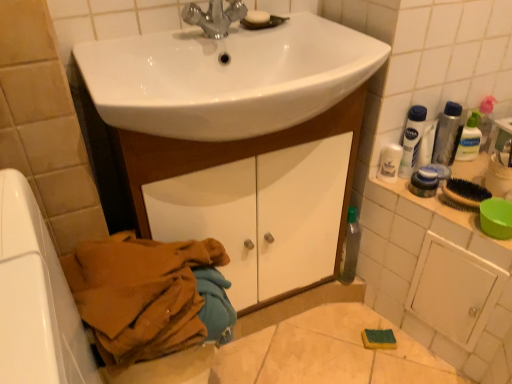
Question: Does white glossy sink at center have a greater height compared to white plastic bottle at upper right?

Choices:
 (A) yes
 (B) no

Answer: (B)

Question: Is white glossy sink at center further to the viewer compared to white plastic bottle at upper right?

Choices:
 (A) no
 (B) yes

Answer: (A)

Question: Considering the relative sizes of white glossy sink at center and white plastic bottle at upper right in the image provided, is white glossy sink at center thinner than white plastic bottle at upper right?

Choices:
 (A) yes
 (B) no

Answer: (B)

Question: Is white glossy sink at center aimed at white plastic bottle at upper right?

Choices:
 (A) no
 (B) yes

Answer: (A)

Question: Does white glossy sink at center have a lesser height compared to white plastic bottle at upper right?

Choices:
 (A) no
 (B) yes

Answer: (B)

Question: From a real-world perspective, does white glossy sink at center sit lower than white plastic bottle at upper right?

Choices:
 (A) no
 (B) yes

Answer: (A)

Question: Is silver metallic faucet at upper center located within clear plastic bottle at upper right, acting as the second toiletry starting from the bottom?

Choices:
 (A) yes
 (B) no

Answer: (B)

Question: Considering the relative sizes of clear plastic bottle at upper right, acting as the second toiletry starting from the bottom, and silver metallic faucet at upper center in the image provided, is clear plastic bottle at upper right, acting as the second toiletry starting from the bottom, thinner than silver metallic faucet at upper center?

Choices:
 (A) yes
 (B) no

Answer: (A)

Question: From a real-world perspective, is clear plastic bottle at upper right, the 1th toiletry when ordered from right to left, positioned over silver metallic faucet at upper center based on gravity?

Choices:
 (A) yes
 (B) no

Answer: (B)

Question: Considering the relative sizes of clear plastic bottle at upper right, positioned as the first toiletry in top-to-bottom order, and silver metallic faucet at upper center in the image provided, is clear plastic bottle at upper right, positioned as the first toiletry in top-to-bottom order, shorter than silver metallic faucet at upper center?

Choices:
 (A) yes
 (B) no

Answer: (A)

Question: Is clear plastic bottle at upper right, the 1th toiletry when ordered from right to left, wider than silver metallic faucet at upper center?

Choices:
 (A) no
 (B) yes

Answer: (A)

Question: Is clear plastic bottle at upper right, the 2th toiletry in the front-to-back sequence, oriented away from silver metallic faucet at upper center?

Choices:
 (A) yes
 (B) no

Answer: (B)

Question: Does clear plastic bottle at upper right, the 1th toiletry when ordered from right to left, have a lesser height compared to white glossy cabinet at center?

Choices:
 (A) yes
 (B) no

Answer: (A)